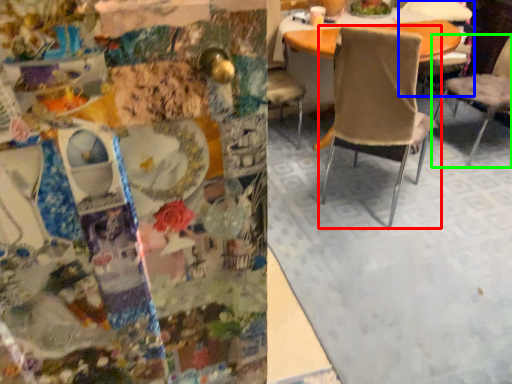
Question: Which object is positioned closest to chair (highlighted by a red box)? Select from chair (highlighted by a blue box) and chair (highlighted by a green box).

Choices:
 (A) chair
 (B) chair

Answer: (B)